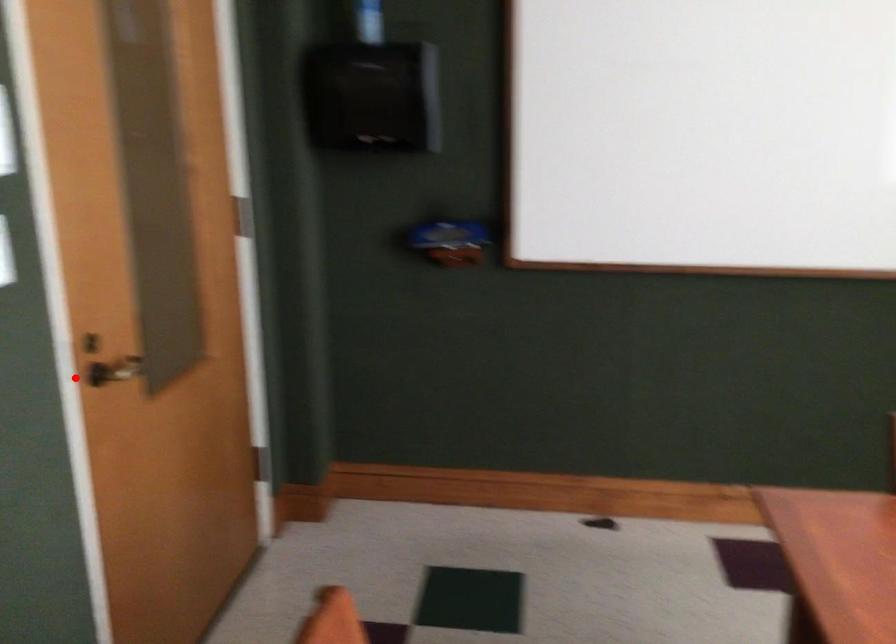
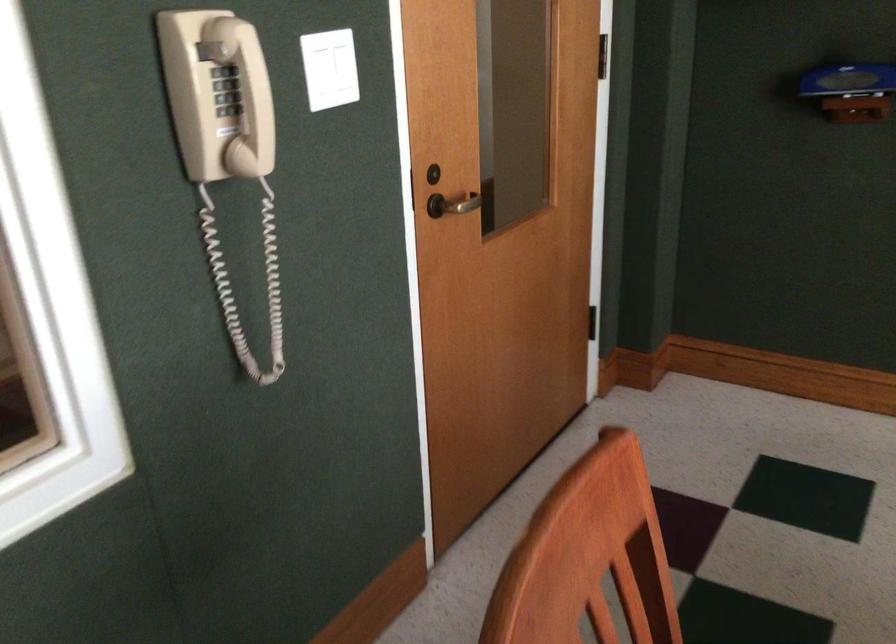
Find the pixel in the second image that matches the highlighted location in the first image.

(409, 191)